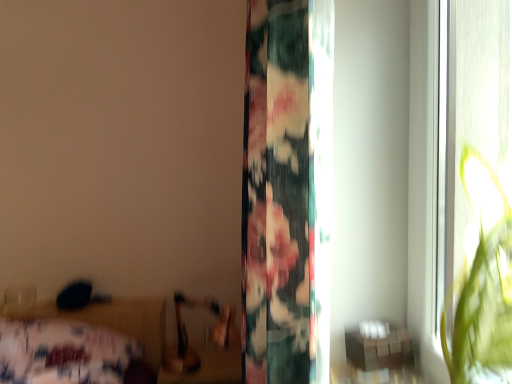
Question: Would you consider floral fabric curtain at center to be distant from wooden table at lower right?

Choices:
 (A) yes
 (B) no

Answer: (B)

Question: Does floral fabric curtain at center turn towards wooden table at lower right?

Choices:
 (A) no
 (B) yes

Answer: (B)

Question: From a real-world perspective, is floral fabric curtain at center located beneath wooden table at lower right?

Choices:
 (A) yes
 (B) no

Answer: (B)

Question: Is floral fabric curtain at center smaller than wooden table at lower right?

Choices:
 (A) no
 (B) yes

Answer: (A)

Question: Is floral fabric curtain at center outside wooden table at lower right?

Choices:
 (A) no
 (B) yes

Answer: (B)

Question: Considering their positions, is wooden table at lower right located in front of or behind floral fabric curtain at center?

Choices:
 (A) behind
 (B) front

Answer: (A)

Question: Visually, is wooden table at lower right positioned to the left or to the right of floral fabric curtain at center?

Choices:
 (A) left
 (B) right

Answer: (B)

Question: Choose the correct answer: Is wooden table at lower right inside floral fabric curtain at center or outside it?

Choices:
 (A) inside
 (B) outside

Answer: (B)

Question: From the image's perspective, relative to floral fabric curtain at center, is wooden table at lower right above or below?

Choices:
 (A) below
 (B) above

Answer: (A)

Question: From a real-world perspective, relative to wooden table at lower right, is floral fabric bed at lower left vertically above or below?

Choices:
 (A) below
 (B) above

Answer: (A)

Question: From the image's perspective, is floral fabric bed at lower left above or below wooden table at lower right?

Choices:
 (A) above
 (B) below

Answer: (B)

Question: In terms of size, does floral fabric bed at lower left appear bigger or smaller than wooden table at lower right?

Choices:
 (A) small
 (B) big

Answer: (B)

Question: Is floral fabric bed at lower left situated inside wooden table at lower right or outside?

Choices:
 (A) outside
 (B) inside

Answer: (A)

Question: Considering the positions of floral fabric curtain at center and floral fabric bed at lower left in the image, is floral fabric curtain at center wider or thinner than floral fabric bed at lower left?

Choices:
 (A) wide
 (B) thin

Answer: (B)

Question: From the image's perspective, is floral fabric curtain at center above or below floral fabric bed at lower left?

Choices:
 (A) above
 (B) below

Answer: (A)